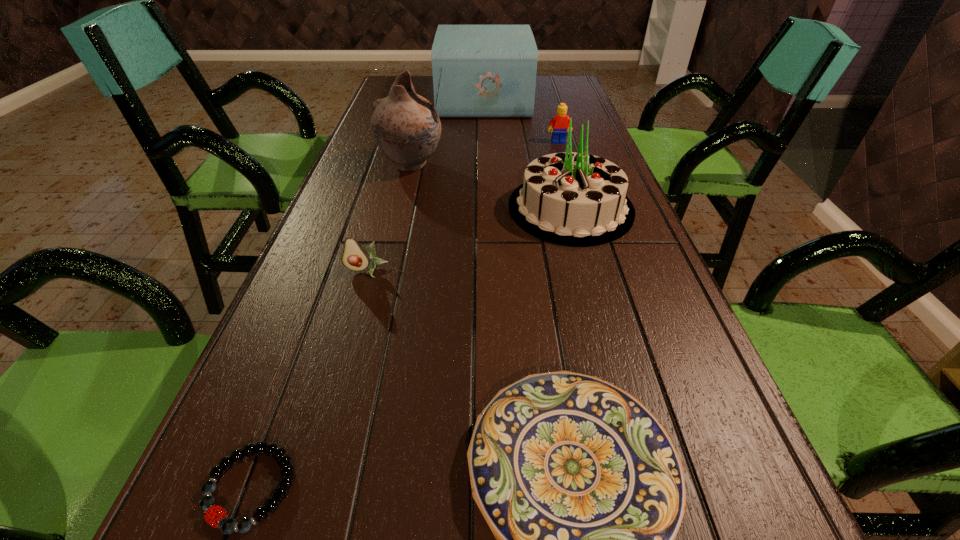
Where is `pottery`? The width and height of the screenshot is (960, 540). pottery is located at coordinates (406, 127).

Image resolution: width=960 pixels, height=540 pixels. What are the coordinates of `the farthest object` in the screenshot? It's located at (479, 71).

Image resolution: width=960 pixels, height=540 pixels. In order to click on birthday cake in this screenshot , I will do `click(574, 199)`.

Locate an element on the screen. Lego is located at coordinates pyautogui.click(x=560, y=122).

This screenshot has height=540, width=960. Find the location of `the sixth nearest object`. the sixth nearest object is located at coordinates (560, 122).

You are a GUI agent. You are given a task and a screenshot of the screen. Output one action in this format:
    pyautogui.click(x=<x>, y=<y>)
    Task: Click on the fifth tallest object
    
    Given the screenshot: What is the action you would take?
    pyautogui.click(x=354, y=257)

Identify the location of the fifth farthest object. (354, 257).

What are the coordinates of `bracelet` in the screenshot? It's located at (228, 525).

Identify the location of free space located from the spout of the pottery. (471, 165).

Locate an element on the screen. The width and height of the screenshot is (960, 540). vacant space located on the front panel of the radio receiver is located at coordinates click(x=414, y=100).